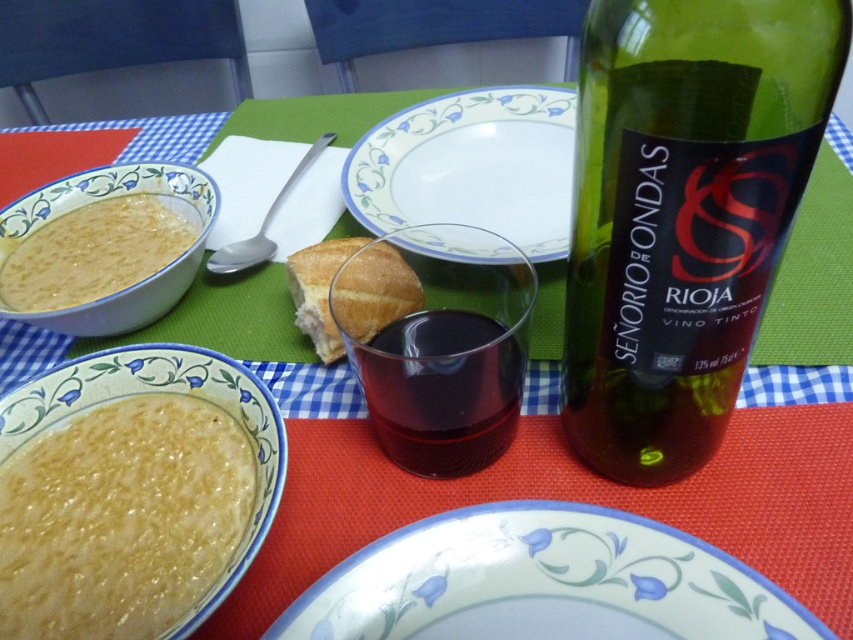
Who is shorter, white floral plate at lower center or white glossy bowl at left?

white floral plate at lower center is shorter.

Identify the location of white floral plate at lower center. (543, 582).

Is green glass bottle at upper right shorter than white glossy bowl at left?

In fact, green glass bottle at upper right may be taller than white glossy bowl at left.

Locate an element on the screen. Image resolution: width=853 pixels, height=640 pixels. green glass bottle at upper right is located at coordinates (683, 211).

This screenshot has height=640, width=853. What are the coordinates of `green glass bottle at upper right` in the screenshot? It's located at (683, 211).

Consider the image. Can you confirm if white floral plate at lower center is positioned below white porcelain plate at center?

Yes.

Is white floral plate at lower center in front of white porcelain plate at center?

Yes, it is.

The width and height of the screenshot is (853, 640). I want to click on white floral plate at lower center, so click(543, 582).

Locate an element on the screen. This screenshot has height=640, width=853. white floral plate at lower center is located at coordinates (543, 582).